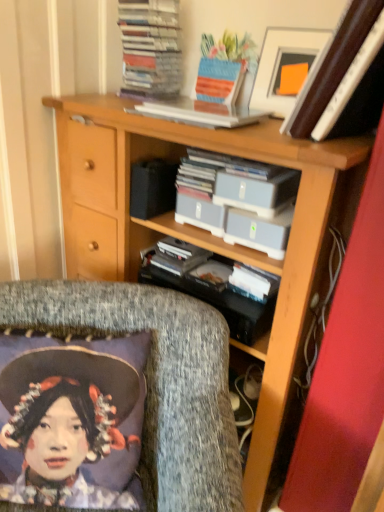
Question: Is wooden bookcase at center bigger or smaller than textured gray cushion at lower left?

Choices:
 (A) small
 (B) big

Answer: (B)

Question: In terms of height, does wooden bookcase at center look taller or shorter compared to textured gray cushion at lower left?

Choices:
 (A) tall
 (B) short

Answer: (A)

Question: Estimate the real-world distances between objects in this image. Which object is farther from the white plastic book at upper center, which appears as the first book when ordered from the bottom?

Choices:
 (A) stacked paper at upper center, the first book viewed from the top
 (B) matte plastic storage boxes at center
 (C) wooden bookcase at center
 (D) gray plastic case at center
 (E) textured gray cushion at lower left

Answer: (E)

Question: Estimate the real-world distances between objects in this image. Which object is farther from the wooden bookcase at center?

Choices:
 (A) white glossy picture frame at upper right
 (B) textured gray cushion at lower left
 (C) gray plastic case at center
 (D) matte plastic storage boxes at center
 (E) white plastic book at upper center, arranged as the 2th book when viewed from the top

Answer: (A)